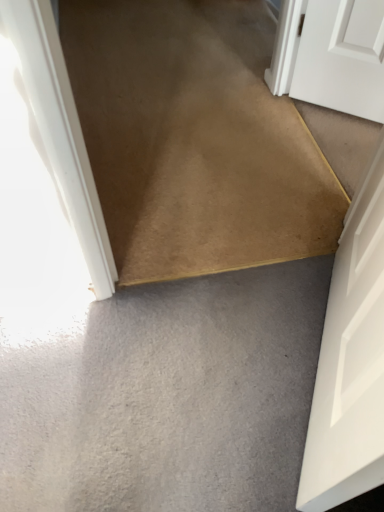
Measure the distance between white matte door at lower right and camera.

The distance of white matte door at lower right from camera is 20.43 inches.

Find the location of a particular element. Image resolution: width=384 pixels, height=512 pixels. white matte door at lower right is located at coordinates (351, 359).

Locate an element on the screen. The image size is (384, 512). carpet at center is located at coordinates (194, 139).

From the image's perspective, who appears lower, gray matte carpet at lower center or carpet at center?

From the image's view, gray matte carpet at lower center is below.

From their relative heights in the image, would you say gray matte carpet at lower center is taller or shorter than carpet at center?

In the image, gray matte carpet at lower center appears to be shorter than carpet at center.

Which is behind, point (22, 340) or point (299, 215)?

The point (299, 215) is behind.

Is carpet at center inside gray matte carpet at lower center?

No, carpet at center is not surrounded by gray matte carpet at lower center.

From the image's perspective, is gray matte carpet at lower center over white matte door at lower right?

Incorrect, from the image's perspective, gray matte carpet at lower center is lower than white matte door at lower right.

Is gray matte carpet at lower center facing away from white matte door at lower right?

gray matte carpet at lower center does not have its back to white matte door at lower right.

Can you tell me how much gray matte carpet at lower center and white matte door at lower right differ in facing direction?

59.7 degrees separate the facing orientations of gray matte carpet at lower center and white matte door at lower right.

Which object is positioned more to the left, gray matte carpet at lower center or white matte door at lower right?

gray matte carpet at lower center is more to the left.

Could you tell me if white matte door at lower right is facing gray matte carpet at lower center?

Yes, white matte door at lower right is turned towards gray matte carpet at lower center.

Based on the photo, is white matte door at lower right bigger than gray matte carpet at lower center?

Yes.

Is gray matte carpet at lower center located within white matte door at lower right?

No, gray matte carpet at lower center is located outside of white matte door at lower right.

Is carpet at center taller than gray matte carpet at lower center?

Yes, carpet at center is taller than gray matte carpet at lower center.

Does carpet at center contain gray matte carpet at lower center?

No, gray matte carpet at lower center is not inside carpet at center.

Is point (189, 197) positioned before point (267, 421)?

No, (189, 197) is behind (267, 421).

Considering the positions of objects carpet at center and gray matte carpet at lower center in the image provided, who is more to the left, carpet at center or gray matte carpet at lower center?

gray matte carpet at lower center is more to the left.

Can you see carpet at center touching white matte door at lower right?

No.

Is carpet at center thinner than white matte door at lower right?

No.

Between carpet at center and white matte door at lower right, which one appears on the left side from the viewer's perspective?

From the viewer's perspective, carpet at center appears more on the left side.

Locate an element on the screen. This screenshot has height=512, width=384. door on the right of carpet at center is located at coordinates (351, 359).

Looking at this image, is white matte door at lower right positioned far away from carpet at center?

white matte door at lower right is actually quite close to carpet at center.

Which point is more forward, (364, 180) or (227, 158)?

The point (364, 180) is closer to the camera.

Measure the distance from white matte door at lower right to carpet at center.

white matte door at lower right and carpet at center are 23.95 inches apart.

There is a carpet at center. Identify the location of concrete above it (from a real-world perspective). (165, 395).

You are a GUI agent. You are given a task and a screenshot of the screen. Output one action in this format:
    pyautogui.click(x=<x>, y=<y>)
    Task: Click on the concrete directly beneath the white matte door at lower right (from a real-world perspective)
    The width and height of the screenshot is (384, 512).
    Given the screenshot: What is the action you would take?
    pyautogui.click(x=165, y=395)

Looking at the image, which one is located closer to white matte door at lower right, gray matte carpet at lower center or carpet at center?

gray matte carpet at lower center lies closer to white matte door at lower right than the other object.

Consider the image. From the image, which object appears to be nearer to carpet at center, white matte door at lower right or gray matte carpet at lower center?

gray matte carpet at lower center lies closer to carpet at center than the other object.

Which object lies further to the anchor point carpet at center, gray matte carpet at lower center or white matte door at lower right?

white matte door at lower right is further to carpet at center.

From the image, which object appears to be nearer to gray matte carpet at lower center, carpet at center or white matte door at lower right?

white matte door at lower right.

From the image, which object appears to be nearer to gray matte carpet at lower center, white matte door at lower right or carpet at center?

Among the two, white matte door at lower right is located nearer to gray matte carpet at lower center.

Considering their positions, is carpet at center positioned closer to white matte door at lower right than gray matte carpet at lower center?

Based on the image, gray matte carpet at lower center appears to be nearer to white matte door at lower right.

You are a GUI agent. You are given a task and a screenshot of the screen. Output one action in this format:
    pyautogui.click(x=<x>, y=<y>)
    Task: Click on the door between carpet at center and gray matte carpet at lower center vertically
    This screenshot has height=512, width=384.
    Given the screenshot: What is the action you would take?
    pyautogui.click(x=351, y=359)